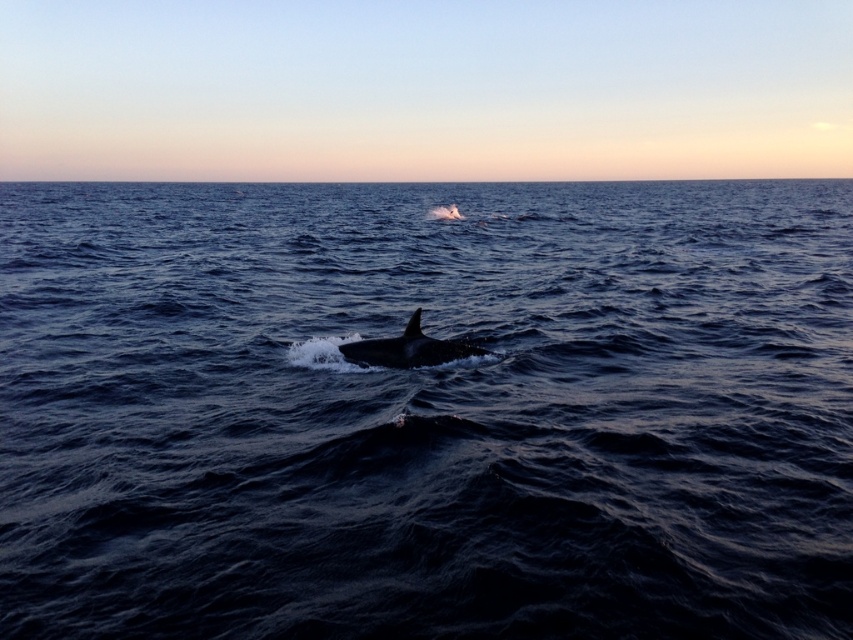
How much distance is there between dark blue water at center and smooth gray whale at center?

The distance of dark blue water at center from smooth gray whale at center is 57.53 feet.

Which is in front, point (567, 340) or point (416, 321)?

Point (416, 321) is more forward.

Which is in front, point (350, 378) or point (405, 346)?

Point (405, 346)

This screenshot has width=853, height=640. Find the location of `dark blue water at center`. dark blue water at center is located at coordinates (426, 412).